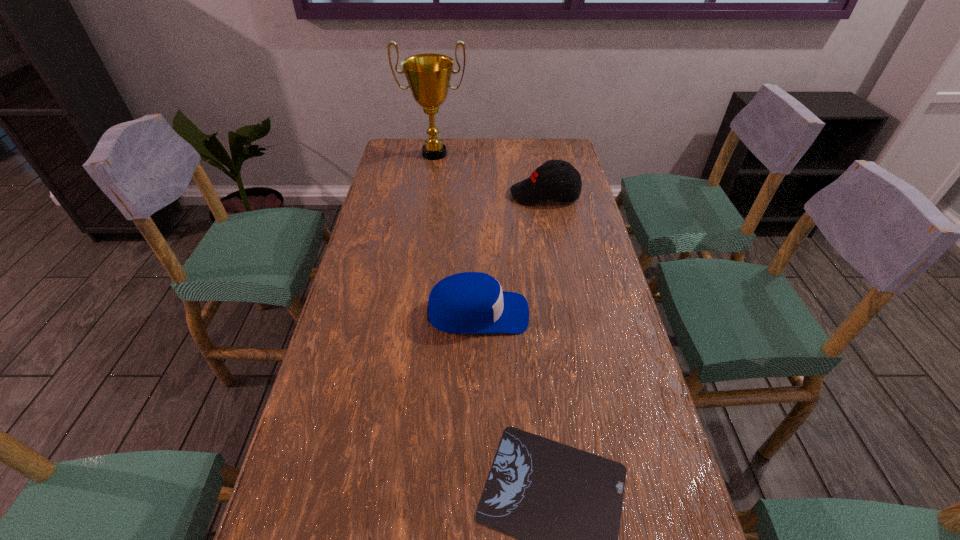
At what (x,y) coordinates should I click in order to perform the action: click on object located in the left edge section of the desktop. Please return your answer as a coordinate pair (x, y). This screenshot has width=960, height=540. Looking at the image, I should click on (428, 75).

The width and height of the screenshot is (960, 540). What are the coordinates of `object situated at the right edge` in the screenshot? It's located at (545, 182).

The width and height of the screenshot is (960, 540). Find the location of `object that is at the far left corner`. object that is at the far left corner is located at coordinates (428, 75).

Identify the location of vacant space at the far edge. This screenshot has width=960, height=540. (508, 161).

Locate an element on the screen. This screenshot has height=540, width=960. free space at the left edge of the desktop is located at coordinates (361, 490).

The width and height of the screenshot is (960, 540). What are the coordinates of `vacant space at the right edge of the desktop` in the screenshot? It's located at (572, 268).

Where is `free space at the far left corner`? The width and height of the screenshot is (960, 540). free space at the far left corner is located at coordinates (396, 145).

The height and width of the screenshot is (540, 960). In order to click on blank space at the far right corner in this screenshot , I will do `click(566, 155)`.

What are the coordinates of `free space that is in between the third nearest object and the award` in the screenshot? It's located at (490, 174).

Where is `vacant space that is in between the third nearest object and the farthest object`? This screenshot has width=960, height=540. vacant space that is in between the third nearest object and the farthest object is located at coordinates (490, 174).